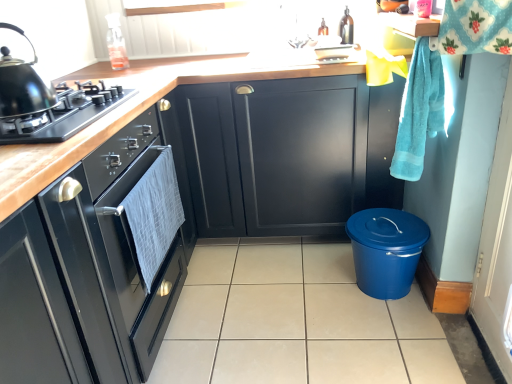
Question: Can you confirm if beige tile at center is thinner than black matte gas stove at left?

Choices:
 (A) no
 (B) yes

Answer: (A)

Question: Is beige tile at center at the right side of black matte gas stove at left?

Choices:
 (A) no
 (B) yes

Answer: (B)

Question: From the image's perspective, is beige tile at center located beneath black matte gas stove at left?

Choices:
 (A) no
 (B) yes

Answer: (B)

Question: Can you confirm if beige tile at center is taller than black matte gas stove at left?

Choices:
 (A) no
 (B) yes

Answer: (A)

Question: Considering the relative positions of beige tile at center and black matte gas stove at left in the image provided, is beige tile at center behind black matte gas stove at left?

Choices:
 (A) yes
 (B) no

Answer: (A)

Question: From a real-world perspective, is beige tile at center over black matte gas stove at left?

Choices:
 (A) no
 (B) yes

Answer: (A)

Question: Is matte black cabinets at center, the first cabinetry from the front, beside beige tile at center?

Choices:
 (A) no
 (B) yes

Answer: (A)

Question: Considering the relative sizes of matte black cabinets at center, the first cabinetry from the front, and beige tile at center in the image provided, is matte black cabinets at center, the first cabinetry from the front, wider than beige tile at center?

Choices:
 (A) no
 (B) yes

Answer: (B)

Question: Is matte black cabinets at center, the first cabinetry from the front, at the left side of beige tile at center?

Choices:
 (A) yes
 (B) no

Answer: (A)

Question: From a real-world perspective, is matte black cabinets at center, the third cabinetry positioned from the back, on beige tile at center?

Choices:
 (A) no
 (B) yes

Answer: (B)

Question: Is matte black cabinets at center, the third cabinetry positioned from the back, looking in the opposite direction of beige tile at center?

Choices:
 (A) yes
 (B) no

Answer: (B)

Question: From the image's perspective, is matte black cabinets at center, the third cabinetry positioned from the back, located beneath beige tile at center?

Choices:
 (A) no
 (B) yes

Answer: (A)

Question: Can you confirm if black matte gas stove at left is wider than matte black cabinet at center, arranged as the 1th cabinetry when viewed from the back?

Choices:
 (A) yes
 (B) no

Answer: (B)